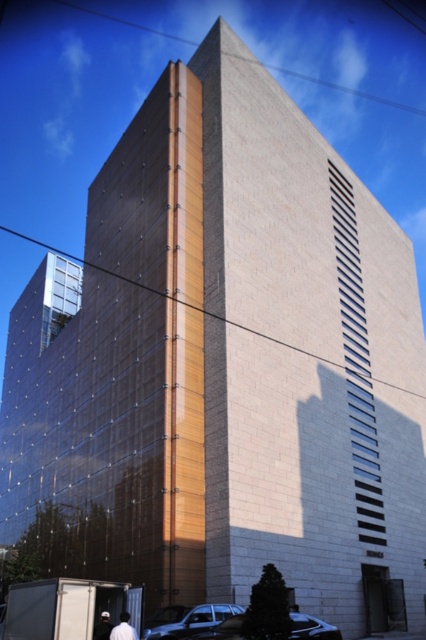
Does point (127, 627) come farther from viewer compared to point (108, 612)?

No, it is not.

This screenshot has height=640, width=426. What do you see at coordinates (123, 628) in the screenshot?
I see `white cotton shirt at lower left` at bounding box center [123, 628].

Locate an element on the screen. This screenshot has width=426, height=640. white cotton shirt at lower left is located at coordinates (123, 628).

From the picture: Who is higher up, metallic silver car at lower center or shiny silver car at lower center?

Positioned higher is metallic silver car at lower center.

Which is in front, point (172, 627) or point (296, 612)?

Point (296, 612) is more forward.

Find the location of a particular element. This screenshot has width=426, height=640. metallic silver car at lower center is located at coordinates (189, 620).

Can you confirm if metallic silver car at lower center is positioned to the left of white cotton cap at lower left?

In fact, metallic silver car at lower center is to the right of white cotton cap at lower left.

Who is taller, metallic silver car at lower center or white cotton cap at lower left?

white cotton cap at lower left is taller.

Between point (192, 627) and point (103, 621), which one is positioned behind?

The point (192, 627) is behind.

Image resolution: width=426 pixels, height=640 pixels. In order to click on metallic silver car at lower center in this screenshot , I will do `click(189, 620)`.